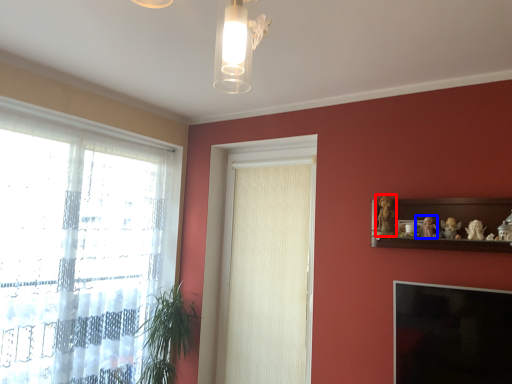
Question: Which object appears closest to the camera in this image, toy (highlighted by a red box) or toy (highlighted by a blue box)?

Choices:
 (A) toy
 (B) toy

Answer: (B)